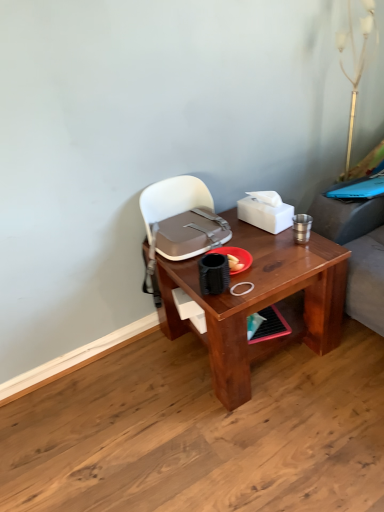
What is the approximate height of brown wooden desk at center?

The height of brown wooden desk at center is 19.95 inches.

This screenshot has height=512, width=384. I want to click on matte gray handbag at center, so click(x=182, y=218).

The height and width of the screenshot is (512, 384). I want to click on gold metallic table lamp at upper right, so click(356, 57).

Considering the sizes of objects matte gray handbag at center and gold metallic table lamp at upper right in the image provided, who is taller, matte gray handbag at center or gold metallic table lamp at upper right?

With more height is gold metallic table lamp at upper right.

Is matte gray handbag at center with gold metallic table lamp at upper right?

No, matte gray handbag at center is not next to gold metallic table lamp at upper right.

Is point (181, 221) positioned behind point (349, 29)?

No, it is not.

In the scene shown: Based on their sizes in the image, would you say matte gray handbag at center is bigger or smaller than gold metallic table lamp at upper right?

Clearly, matte gray handbag at center is larger in size than gold metallic table lamp at upper right.

From the picture: From a real-world perspective, is matte gray handbag at center on top of white matte tissue box at upper right?

No, from a real-world perspective, matte gray handbag at center is not over white matte tissue box at upper right

Between matte gray handbag at center and white matte tissue box at upper right, which one has larger width?

matte gray handbag at center is wider.

Which is in front, matte gray handbag at center or white matte tissue box at upper right?

matte gray handbag at center is more forward.

Is matte gray handbag at center oriented towards white matte tissue box at upper right?

No.

Looking at the image, does brown wooden desk at center seem bigger or smaller compared to gold metallic table lamp at upper right?

In the image, brown wooden desk at center appears to be larger than gold metallic table lamp at upper right.

Relative to gold metallic table lamp at upper right, is brown wooden desk at center in front or behind?

Clearly, brown wooden desk at center is in front of gold metallic table lamp at upper right.

Does brown wooden desk at center have a lesser height compared to gold metallic table lamp at upper right?

Correct, brown wooden desk at center is not as tall as gold metallic table lamp at upper right.

Locate an element on the screen. desk in front of the gold metallic table lamp at upper right is located at coordinates (261, 302).

Can we say gold metallic table lamp at upper right lies outside brown wooden desk at center?

gold metallic table lamp at upper right lies outside brown wooden desk at center's area.

Who is shorter, gold metallic table lamp at upper right or brown wooden desk at center?

brown wooden desk at center is shorter.

Which of these two, gold metallic table lamp at upper right or brown wooden desk at center, is wider?

brown wooden desk at center.

The width and height of the screenshot is (384, 512). Find the location of `desk below the white matte tissue box at upper right (from the image's perspective)`. desk below the white matte tissue box at upper right (from the image's perspective) is located at coordinates coord(261,302).

Can we say brown wooden desk at center lies outside white matte tissue box at upper right?

brown wooden desk at center is positioned outside white matte tissue box at upper right.

In the scene shown: Can you confirm if brown wooden desk at center is shorter than white matte tissue box at upper right?

No, brown wooden desk at center is not shorter than white matte tissue box at upper right.

How distant is brown wooden desk at center from white matte tissue box at upper right?

12.26 inches.

From a real-world perspective, does white matte tissue box at upper right sit lower than brown wooden desk at center?

No, from a real-world perspective, white matte tissue box at upper right is not below brown wooden desk at center.

Is white matte tissue box at upper right far from brown wooden desk at center?

white matte tissue box at upper right is actually quite close to brown wooden desk at center.

At what (x,y) coordinates should I click in order to perform the action: click on desk on the left of white matte tissue box at upper right. Please return your answer as a coordinate pair (x, y). Looking at the image, I should click on (261, 302).

In the scene shown: Is white matte tissue box at upper right shorter than brown wooden desk at center?

Correct, white matte tissue box at upper right is not as tall as brown wooden desk at center.

Does white matte tissue box at upper right contain gold metallic table lamp at upper right?

No, gold metallic table lamp at upper right is located outside of white matte tissue box at upper right.

Does point (273, 193) come farther from viewer compared to point (337, 33)?

No, it is in front of (337, 33).

Which object is thinner, white matte tissue box at upper right or gold metallic table lamp at upper right?

gold metallic table lamp at upper right is thinner.

From a real-world perspective, which is physically above, white matte tissue box at upper right or gold metallic table lamp at upper right?

In real-world perspective, gold metallic table lamp at upper right is above.

Locate an element on the screen. table lamp lying on the right of matte gray handbag at center is located at coordinates (356, 57).

Find the location of a particular element. The image size is (384, 512). handbag lying on the left of white matte tissue box at upper right is located at coordinates (182, 218).

When comparing their distances from brown wooden desk at center, does white matte tissue box at upper right or matte gray handbag at center seem closer?

The object closer to brown wooden desk at center is matte gray handbag at center.

Based on the photo, looking at the image, which one is located closer to matte gray handbag at center, gold metallic table lamp at upper right or brown wooden desk at center?

The object closer to matte gray handbag at center is brown wooden desk at center.

Considering their positions, is white matte tissue box at upper right positioned closer to brown wooden desk at center than gold metallic table lamp at upper right?

Answer: white matte tissue box at upper right is closer to brown wooden desk at center.

Based on their spatial positions, is brown wooden desk at center or matte gray handbag at center further from white matte tissue box at upper right?

brown wooden desk at center is positioned further to the anchor white matte tissue box at upper right.

Estimate the real-world distances between objects in this image. Which object is further from matte gray handbag at center, brown wooden desk at center or white matte tissue box at upper right?

brown wooden desk at center is positioned further to the anchor matte gray handbag at center.

From the image, which object appears to be farther from gold metallic table lamp at upper right, white matte tissue box at upper right or brown wooden desk at center?

brown wooden desk at center lies further to gold metallic table lamp at upper right than the other object.

Estimate the real-world distances between objects in this image. Which object is further from white matte tissue box at upper right, brown wooden desk at center or gold metallic table lamp at upper right?

gold metallic table lamp at upper right.

When comparing their distances from brown wooden desk at center, does matte gray handbag at center or gold metallic table lamp at upper right seem further?

gold metallic table lamp at upper right lies further to brown wooden desk at center than the other object.

At what (x,y) coordinates should I click in order to perform the action: click on box between gold metallic table lamp at upper right and brown wooden desk at center vertically. Please return your answer as a coordinate pair (x, y). Looking at the image, I should click on (265, 211).

Find the location of a particular element. The image size is (384, 512). handbag between white matte tissue box at upper right and brown wooden desk at center vertically is located at coordinates (182, 218).

The height and width of the screenshot is (512, 384). In order to click on box situated between matte gray handbag at center and gold metallic table lamp at upper right from left to right in this screenshot , I will do `click(265, 211)`.

I want to click on handbag between gold metallic table lamp at upper right and brown wooden desk at center from top to bottom, so click(182, 218).